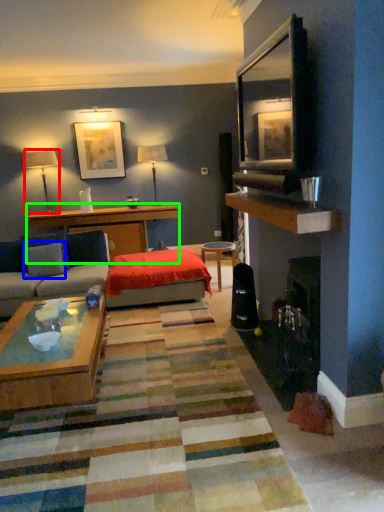
Question: Based on their relative distances, which object is farther from lamp (highlighted by a red box)? Choose from pillow (highlighted by a blue box) and desk (highlighted by a green box).

Choices:
 (A) pillow
 (B) desk

Answer: (A)